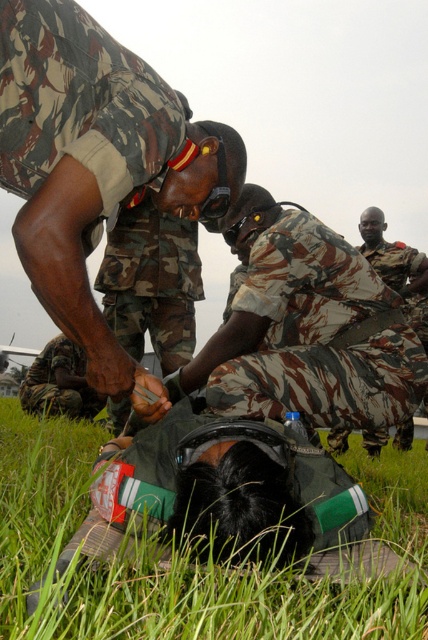
In the scene, there are two individuals wearing camo uniform at center and camouflage uniform at center. Which one has a narrower width?

The camo uniform at center has a lesser width compared to the camouflage uniform at center.

Based on the scene description, which object is positioned lower in the image, the green grass at lower center or the camouflage uniform at center?

The green grass at lower center is positioned below the camouflage uniform at center, so it is lower in the image.